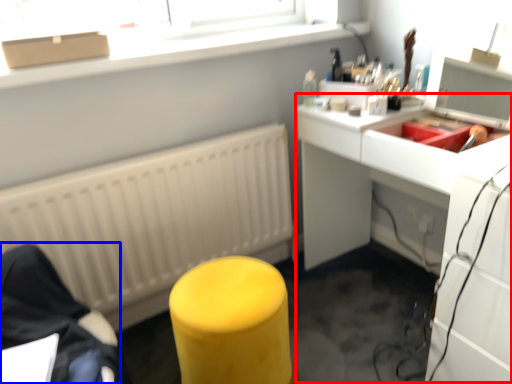
Question: Which of the following is the closest to the observer, computer desk (highlighted by a red box) or furniture (highlighted by a blue box)?

Choices:
 (A) computer desk
 (B) furniture

Answer: (A)